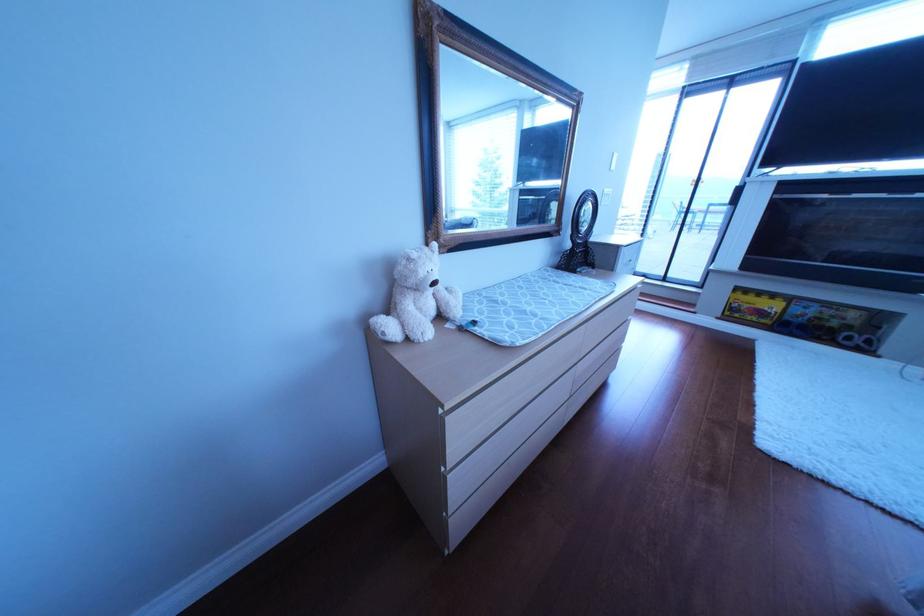
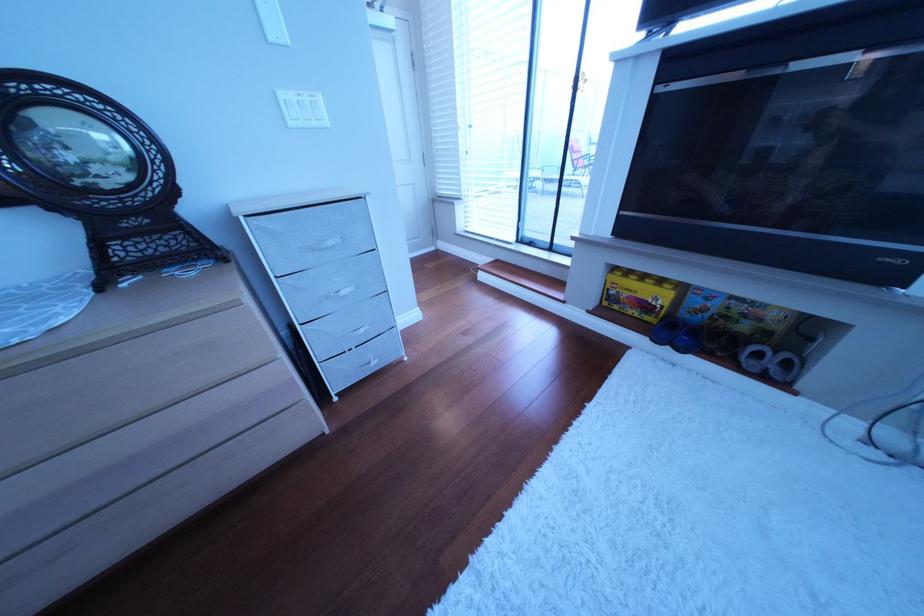
Find the pixel in the second image that matches point (761, 308) in the first image.

(640, 296)